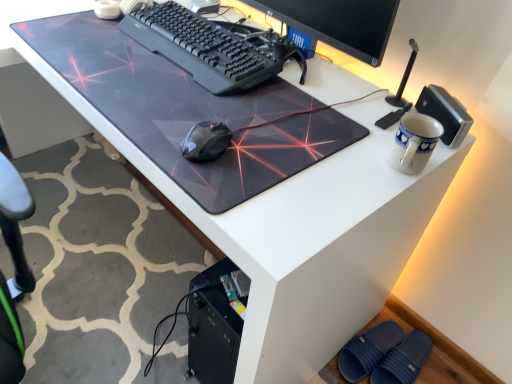
This screenshot has height=384, width=512. In order to click on vacant area situated below transparent plastic mousepad at center (from a real-world perspective) in this screenshot , I will do `click(155, 77)`.